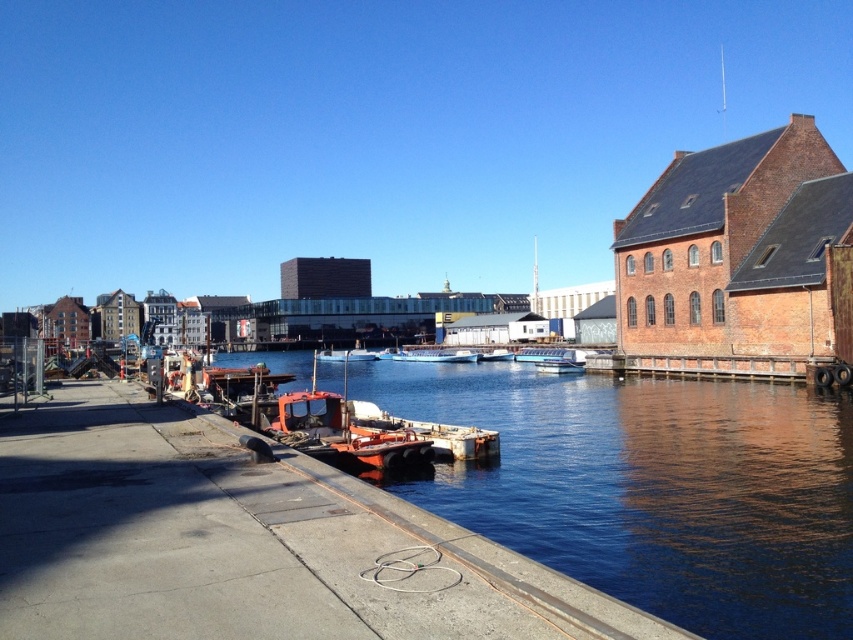
You are a photographer standing on the walkway and want to take a photo of both the white plastic boat at center and the metallic orange boat at center. Which boat will appear larger in your photo?

The white plastic boat at center will appear larger in the photo because it is closer to the viewer than the metallic orange boat at center.

You are a photographer planning to capture the entire scene in one shot. Given that your camera can only focus on objects within a 10m width, will the blue water at lower left and the white matte boat at center fit within the frame without cropping?

The blue water at lower left is wider than the white matte boat at center. Since the camera can focus on objects within a 10m width, both objects can fit within the frame as their combined width is less than 10m.